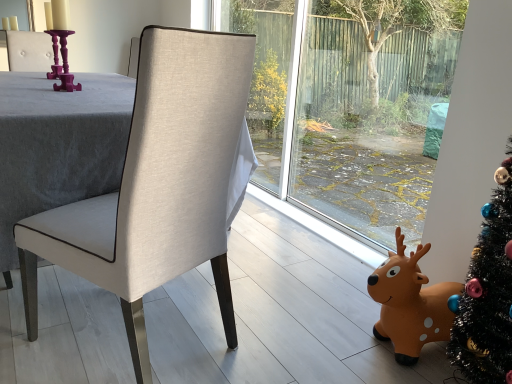
Identify the location of blank area beneath matte beige fabric chair at center (from a real-world perspective). This screenshot has height=384, width=512. (149, 347).